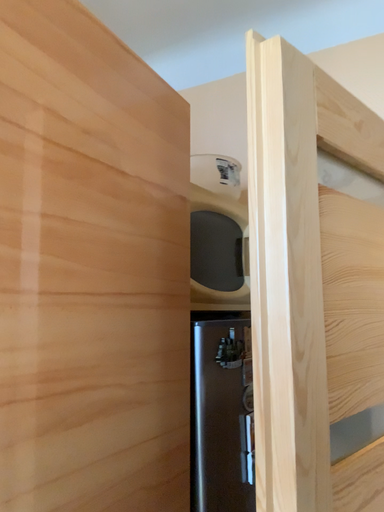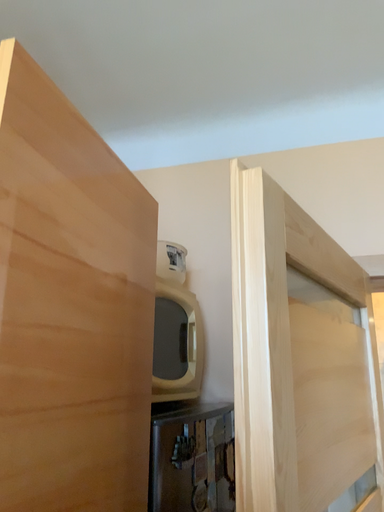
Question: Which way did the camera rotate in the video?

Choices:
 (A) rotated right
 (B) rotated left

Answer: (A)